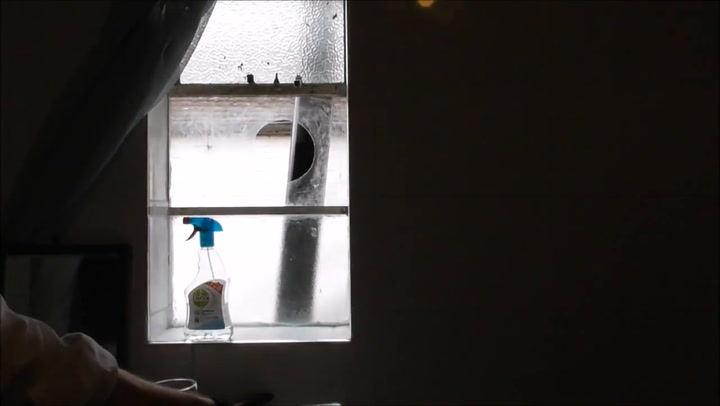
Where is `curtain`? The height and width of the screenshot is (406, 720). curtain is located at coordinates (117, 67).